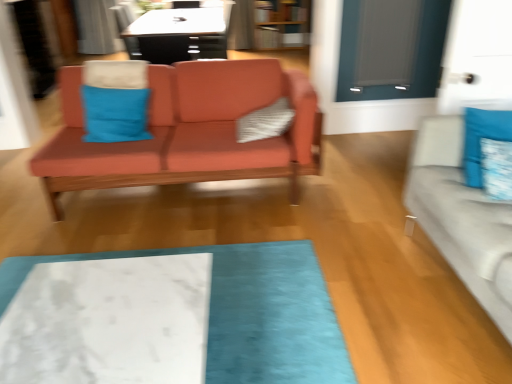
Locate an element on the screen. The image size is (512, 384). vacant point above white marble mat at lower center (from a real-world perspective) is located at coordinates (95, 316).